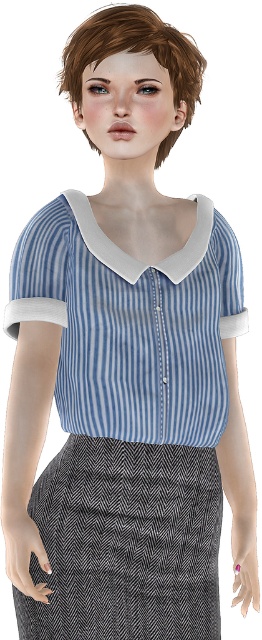
Who is shorter, blue striped shirt at center or brown matte hair at upper center?

brown matte hair at upper center

Does blue striped shirt at center appear under brown matte hair at upper center?

Yes.

Which is in front, point (181, 301) or point (121, 13)?

Positioned in front is point (121, 13).

Locate an element on the screen. The width and height of the screenshot is (262, 640). blue striped shirt at center is located at coordinates (132, 323).

Between point (140, 627) and point (199, 67), which one is positioned behind?

The point (199, 67) is behind.

Who is shorter, herringbone wool skirt at lower center or brown matte hair at upper center?

Standing shorter between the two is brown matte hair at upper center.

Locate an element on the screen. This screenshot has width=262, height=640. herringbone wool skirt at lower center is located at coordinates (126, 541).

Find the location of a particular element. The height and width of the screenshot is (640, 262). blue striped shirt at center is located at coordinates (132, 323).

What are the coordinates of `blue striped shirt at center` in the screenshot? It's located at (132, 323).